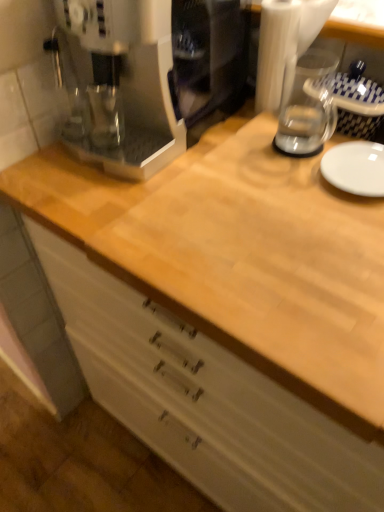
The image size is (384, 512). What do you see at coordinates (355, 168) in the screenshot? I see `white glossy plate at right` at bounding box center [355, 168].

The height and width of the screenshot is (512, 384). What do you see at coordinates (292, 73) in the screenshot?
I see `transparent glass blender at upper right` at bounding box center [292, 73].

What do you see at coordinates (204, 400) in the screenshot?
I see `natural wood cabinet at center` at bounding box center [204, 400].

This screenshot has height=512, width=384. In order to click on natural wood cabinet at center in this screenshot , I will do [x=204, y=400].

I want to click on white glossy plate at right, so click(355, 168).

Is transparent glass blender at upper right oriented away from natural wood cabinet at center?

No, natural wood cabinet at center is not at the back of transparent glass blender at upper right.

Which of these two, transparent glass blender at upper right or natural wood cabinet at center, is wider?

With larger width is natural wood cabinet at center.

What's the angular difference between transparent glass blender at upper right and natural wood cabinet at center's facing directions?

0.00155 degrees.

Considering the positions of objects transparent glass blender at upper right and natural wood cabinet at center in the image provided, who is in front, transparent glass blender at upper right or natural wood cabinet at center?

Positioned in front is natural wood cabinet at center.

Between natural wood cabinet at center and transparent glass blender at upper right, which one has more height?

natural wood cabinet at center is taller.

Which object is positioned more to the left, natural wood cabinet at center or transparent glass blender at upper right?

Positioned to the left is natural wood cabinet at center.

Which of these two, natural wood cabinet at center or transparent glass blender at upper right, is smaller?

Smaller between the two is transparent glass blender at upper right.

Based on the photo, how different are the orientations of natural wood cabinet at center and transparent glass blender at upper right in degrees?

0.00155 degrees.

Identify the location of plate behind the natural wood cabinet at center. (355, 168).

Is natural wood cabinet at center not near white glossy plate at right?

No.

How distant is natural wood cabinet at center from white glossy plate at right?

natural wood cabinet at center is 20.90 inches away from white glossy plate at right.

Can you tell me how much natural wood cabinet at center and white glossy plate at right differ in facing direction?

There is a 0.000325-degree angle between the facing directions of natural wood cabinet at center and white glossy plate at right.

Considering the relative positions of white glossy plate at right and natural wood cabinet at center in the image provided, is white glossy plate at right to the left or to the right of natural wood cabinet at center?

white glossy plate at right is to the right of natural wood cabinet at center.

From a real-world perspective, is white glossy plate at right located higher than natural wood cabinet at center?

Yes.

In the scene shown: Is white glossy plate at right facing away from natural wood cabinet at center?

No, white glossy plate at right is not facing away from natural wood cabinet at center.

Looking at this image, which is in front, white glossy plate at right or natural wood cabinet at center?

natural wood cabinet at center is closer to the camera.

In order to click on plate behind the transparent glass blender at upper right in this screenshot , I will do `click(355, 168)`.

Is white glossy plate at right inside the boundaries of transparent glass blender at upper right, or outside?

white glossy plate at right is outside transparent glass blender at upper right.

Does white glossy plate at right turn towards transparent glass blender at upper right?

No, white glossy plate at right is not facing towards transparent glass blender at upper right.

What's the angular difference between white glossy plate at right and transparent glass blender at upper right's facing directions?

0.00127 degrees.

I want to click on blender on the left of white glossy plate at right, so click(x=292, y=73).

Which object is positioned more to the right, transparent glass blender at upper right or white glossy plate at right?

white glossy plate at right.

Is transparent glass blender at upper right spatially inside white glossy plate at right, or outside of it?

transparent glass blender at upper right lies outside white glossy plate at right.

Where is `cabinetry located underneath the transparent glass blender at upper right (from a real-world perspective)`? The height and width of the screenshot is (512, 384). cabinetry located underneath the transparent glass blender at upper right (from a real-world perspective) is located at coordinates (204, 400).

You are a GUI agent. You are given a task and a screenshot of the screen. Output one action in this format:
    pyautogui.click(x=<x>, y=<y>)
    Task: Click on the blender that appears above the natural wood cabinet at center (from the image's perspective)
    
    Given the screenshot: What is the action you would take?
    pyautogui.click(x=292, y=73)

Considering their positions, is transparent glass blender at upper right positioned further to white glossy plate at right than natural wood cabinet at center?

natural wood cabinet at center is further to white glossy plate at right.

Estimate the real-world distances between objects in this image. Which object is further from transparent glass blender at upper right, natural wood cabinet at center or white glossy plate at right?

The object further to transparent glass blender at upper right is natural wood cabinet at center.

Looking at the image, which one is located closer to transparent glass blender at upper right, white glossy plate at right or natural wood cabinet at center?

white glossy plate at right is positioned closer to the anchor transparent glass blender at upper right.

When comparing their distances from natural wood cabinet at center, does white glossy plate at right or transparent glass blender at upper right seem closer?

The object closer to natural wood cabinet at center is white glossy plate at right.

Looking at this image, when comparing their distances from white glossy plate at right, does natural wood cabinet at center or transparent glass blender at upper right seem closer?

transparent glass blender at upper right is positioned closer to the anchor white glossy plate at right.

When comparing their distances from natural wood cabinet at center, does transparent glass blender at upper right or white glossy plate at right seem further?

transparent glass blender at upper right is positioned further to the anchor natural wood cabinet at center.

This screenshot has height=512, width=384. What are the coordinates of `plate between transparent glass blender at upper right and natural wood cabinet at center vertically` in the screenshot? It's located at pyautogui.click(x=355, y=168).